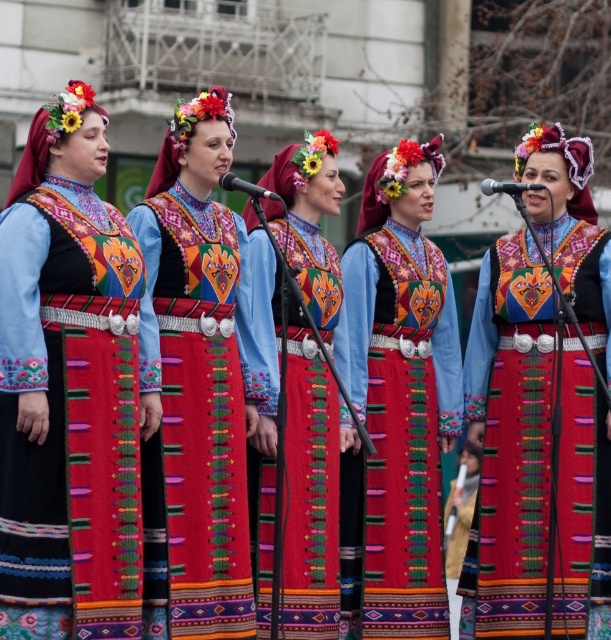
Is point (254, 412) positioned after point (310, 612)?

No, it is in front of (310, 612).

Is point (166, 522) positioned before point (255, 314)?

Yes, it is.

Where is `embroidered fabric dress at center`? The image size is (611, 640). embroidered fabric dress at center is located at coordinates (202, 369).

Does matte black dress at center have a lesser height compared to matte blue dress at center?

Yes.

Looking at this image, between matte black dress at center and matte blue dress at center, which one appears on the right side from the viewer's perspective?

Positioned to the right is matte blue dress at center.

Where is `matte black dress at center`? The height and width of the screenshot is (640, 611). matte black dress at center is located at coordinates (70, 384).

Which is below, matte blue dress at center or embroidered fabric dress at center?

matte blue dress at center is lower down.

Is point (499, 458) farther from viewer compared to point (202, 433)?

Yes, point (499, 458) is farther from viewer.

What do you see at coordinates (510, 440) in the screenshot?
I see `matte blue dress at center` at bounding box center [510, 440].

Identify the location of matte blue dress at center. (510, 440).